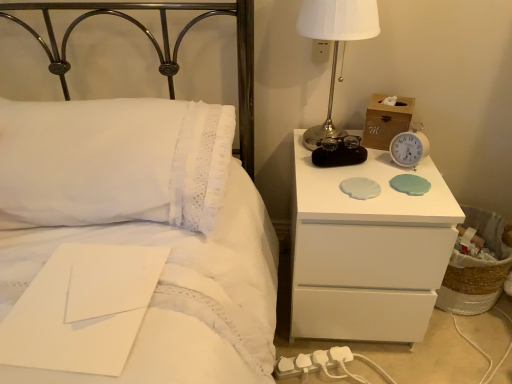
Question: Does white plastic electric outlet at upper center have a larger size compared to white lace pillow at upper left?

Choices:
 (A) yes
 (B) no

Answer: (B)

Question: Can we say white plastic electric outlet at upper center lies outside white lace pillow at upper left?

Choices:
 (A) yes
 (B) no

Answer: (A)

Question: From a real-world perspective, does white plastic electric outlet at upper center sit lower than white lace pillow at upper left?

Choices:
 (A) yes
 (B) no

Answer: (B)

Question: Can you confirm if white plastic electric outlet at upper center is shorter than white lace pillow at upper left?

Choices:
 (A) yes
 (B) no

Answer: (A)

Question: From the image's perspective, is white plastic electric outlet at upper center on top of white lace pillow at upper left?

Choices:
 (A) yes
 (B) no

Answer: (A)

Question: From a real-world perspective, does white plastic electric outlet at upper center stand above white lace pillow at upper left?

Choices:
 (A) yes
 (B) no

Answer: (A)

Question: Is white lace pillow at upper left positioned beyond the bounds of white lace pillow at upper left?

Choices:
 (A) no
 (B) yes

Answer: (B)

Question: Does white lace pillow at upper left have a lesser width compared to white lace pillow at upper left?

Choices:
 (A) yes
 (B) no

Answer: (B)

Question: Considering the relative positions of white lace pillow at upper left and white lace pillow at upper left in the image provided, is white lace pillow at upper left to the left of white lace pillow at upper left from the viewer's perspective?

Choices:
 (A) yes
 (B) no

Answer: (A)

Question: Considering the relative positions of white lace pillow at upper left and white lace pillow at upper left in the image provided, is white lace pillow at upper left in front of white lace pillow at upper left?

Choices:
 (A) no
 (B) yes

Answer: (B)

Question: Does white lace pillow at upper left have a greater width compared to white lace pillow at upper left?

Choices:
 (A) no
 (B) yes

Answer: (B)

Question: From a real-world perspective, is white lace pillow at upper left physically above white lace pillow at upper left?

Choices:
 (A) no
 (B) yes

Answer: (A)

Question: From the image's perspective, is white glossy nightstand at right located beneath white plastic alarm clock at upper right, which is counted as the 2th alarm clock, starting from the right?

Choices:
 (A) yes
 (B) no

Answer: (A)